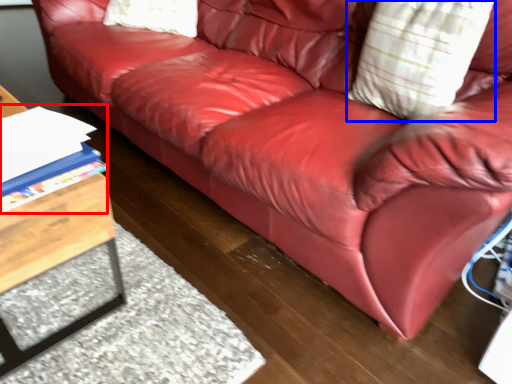
Question: Which of the following is the farthest to the observer, book (highlighted by a red box) or throw pillow (highlighted by a blue box)?

Choices:
 (A) book
 (B) throw pillow

Answer: (B)